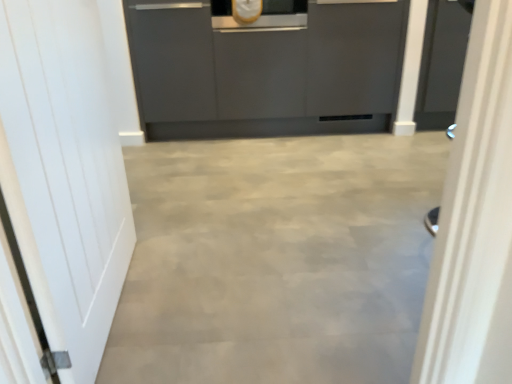
Describe the element at coordinates (475, 222) in the screenshot. I see `white glossy door at right, which ranks as the second door in left-to-right order` at that location.

Find the location of a particular element. The image size is (512, 384). white matte door at left, the first door when ordered from left to right is located at coordinates tap(66, 171).

Measure the distance between point (101,29) and camera.

A distance of 1.57 meters exists between point (101,29) and camera.

Where is `white glossy door at right, the first door viewed from the right`? Image resolution: width=512 pixels, height=384 pixels. white glossy door at right, the first door viewed from the right is located at coordinates (475, 222).

Considering their positions, is white matte door at left, the first door when ordered from left to right, located in front of or behind white glossy door at right, which ranks as the second door in left-to-right order?

Clearly, white matte door at left, the first door when ordered from left to right, is in front of white glossy door at right, which ranks as the second door in left-to-right order.

Does white matte door at left, the first door when ordered from left to right, have a larger size compared to white glossy door at right, the first door viewed from the right?

Correct, white matte door at left, the first door when ordered from left to right, is larger in size than white glossy door at right, the first door viewed from the right.

Which object is thinner, white matte door at left, the first door when ordered from left to right, or white glossy door at right, which ranks as the second door in left-to-right order?

white matte door at left, the first door when ordered from left to right.

Considering the positions of points (87, 198) and (473, 158), is point (87, 198) closer to camera compared to point (473, 158)?

No.

You are a GUI agent. You are given a task and a screenshot of the screen. Output one action in this format:
    pyautogui.click(x=<x>, y=<y>)
    Task: Click on the door located on the right of matte gray cabinetry at center
    This screenshot has height=384, width=512.
    Given the screenshot: What is the action you would take?
    pyautogui.click(x=475, y=222)

Is white glossy door at right, which ranks as the second door in left-to-right order, situated inside matte gray cabinetry at center or outside?

white glossy door at right, which ranks as the second door in left-to-right order, exists outside the volume of matte gray cabinetry at center.

Is white glossy door at right, which ranks as the second door in left-to-right order, wider or thinner than matte gray cabinetry at center?

white glossy door at right, which ranks as the second door in left-to-right order, is thinner than matte gray cabinetry at center.

From a real-world perspective, is white glossy door at right, the first door viewed from the right, under matte gray cabinetry at center?

Correct, in the physical world, white glossy door at right, the first door viewed from the right, is lower than matte gray cabinetry at center.

Is white glossy door at right, the first door viewed from the right, bigger than white matte door at left, the first door when ordered from left to right?

Actually, white glossy door at right, the first door viewed from the right, might be smaller than white matte door at left, the first door when ordered from left to right.

Is white glossy door at right, which ranks as the second door in left-to-right order, positioned in front of white matte door at left, the first door when ordered from left to right?

No, it is not.

Is white glossy door at right, which ranks as the second door in left-to-right order, wider than white matte door at left, the 2th door when ordered from right to left?

Correct, the width of white glossy door at right, which ranks as the second door in left-to-right order, exceeds that of white matte door at left, the 2th door when ordered from right to left.

Image resolution: width=512 pixels, height=384 pixels. I want to click on door located underneath the white matte door at left, the 2th door when ordered from right to left (from a real-world perspective), so click(x=475, y=222).

Does white matte door at left, the 2th door when ordered from right to left, have a greater height compared to matte gray cabinetry at center?

Correct, white matte door at left, the 2th door when ordered from right to left, is much taller as matte gray cabinetry at center.

From a real-world perspective, is white matte door at left, the 2th door when ordered from right to left, positioned under matte gray cabinetry at center based on gravity?

Actually, white matte door at left, the 2th door when ordered from right to left, is physically above matte gray cabinetry at center in the real world.

How distant is white matte door at left, the 2th door when ordered from right to left, from matte gray cabinetry at center?

white matte door at left, the 2th door when ordered from right to left, is 1.62 meters away from matte gray cabinetry at center.

Who is smaller, white matte door at left, the first door when ordered from left to right, or matte gray cabinetry at center?

Smaller between the two is white matte door at left, the first door when ordered from left to right.

Could you tell me if matte gray cabinetry at center is turned towards white matte door at left, the first door when ordered from left to right?

Yes, matte gray cabinetry at center is oriented towards white matte door at left, the first door when ordered from left to right.

Can you confirm if matte gray cabinetry at center is shorter than white matte door at left, the 2th door when ordered from right to left?

Correct, matte gray cabinetry at center is not as tall as white matte door at left, the 2th door when ordered from right to left.

Is matte gray cabinetry at center with white matte door at left, the 2th door when ordered from right to left?

No, matte gray cabinetry at center is not next to white matte door at left, the 2th door when ordered from right to left.

Can you confirm if matte gray cabinetry at center is positioned to the left of white matte door at left, the first door when ordered from left to right?

No.

Is matte gray cabinetry at center closer to camera compared to white glossy door at right, the first door viewed from the right?

That is False.

Is matte gray cabinetry at center not near white glossy door at right, which ranks as the second door in left-to-right order?

That's right, there is a large distance between matte gray cabinetry at center and white glossy door at right, which ranks as the second door in left-to-right order.

Could you measure the distance between matte gray cabinetry at center and white glossy door at right, which ranks as the second door in left-to-right order?

A distance of 7.35 feet exists between matte gray cabinetry at center and white glossy door at right, which ranks as the second door in left-to-right order.

Considering the relative positions of matte gray cabinetry at center and white glossy door at right, which ranks as the second door in left-to-right order, in the image provided, is matte gray cabinetry at center to the right of white glossy door at right, which ranks as the second door in left-to-right order, from the viewer's perspective?

No.

The height and width of the screenshot is (384, 512). In order to click on door lying below the white glossy door at right, the first door viewed from the right (from the image's perspective) in this screenshot , I will do `click(66, 171)`.

Find the location of a particular element. This screenshot has width=512, height=384. cabinetry behind the white glossy door at right, which ranks as the second door in left-to-right order is located at coordinates (264, 69).

Estimate the real-world distances between objects in this image. Which object is further from matte gray cabinetry at center, white glossy door at right, the first door viewed from the right, or white matte door at left, the 2th door when ordered from right to left?

Based on the image, white glossy door at right, the first door viewed from the right, appears to be further to matte gray cabinetry at center.

From the picture: From the image, which object appears to be farther from white matte door at left, the 2th door when ordered from right to left, matte gray cabinetry at center or white glossy door at right, the first door viewed from the right?

Among the two, matte gray cabinetry at center is located further to white matte door at left, the 2th door when ordered from right to left.

Looking at the image, which one is located closer to matte gray cabinetry at center, white matte door at left, the 2th door when ordered from right to left, or white glossy door at right, which ranks as the second door in left-to-right order?

white matte door at left, the 2th door when ordered from right to left, lies closer to matte gray cabinetry at center than the other object.

When comparing their distances from white glossy door at right, the first door viewed from the right, does matte gray cabinetry at center or white matte door at left, the first door when ordered from left to right, seem further?

Among the two, matte gray cabinetry at center is located further to white glossy door at right, the first door viewed from the right.

From the image, which object appears to be nearer to white glossy door at right, which ranks as the second door in left-to-right order, white matte door at left, the 2th door when ordered from right to left, or matte gray cabinetry at center?

white matte door at left, the 2th door when ordered from right to left, is positioned closer to the anchor white glossy door at right, which ranks as the second door in left-to-right order.

Based on their spatial positions, is white glossy door at right, which ranks as the second door in left-to-right order, or matte gray cabinetry at center further from white matte door at left, the 2th door when ordered from right to left?

Based on the image, matte gray cabinetry at center appears to be further to white matte door at left, the 2th door when ordered from right to left.

Where is `door between white matte door at left, the first door when ordered from left to right, and matte gray cabinetry at center, along the z-axis`? This screenshot has height=384, width=512. door between white matte door at left, the first door when ordered from left to right, and matte gray cabinetry at center, along the z-axis is located at coordinates (475, 222).